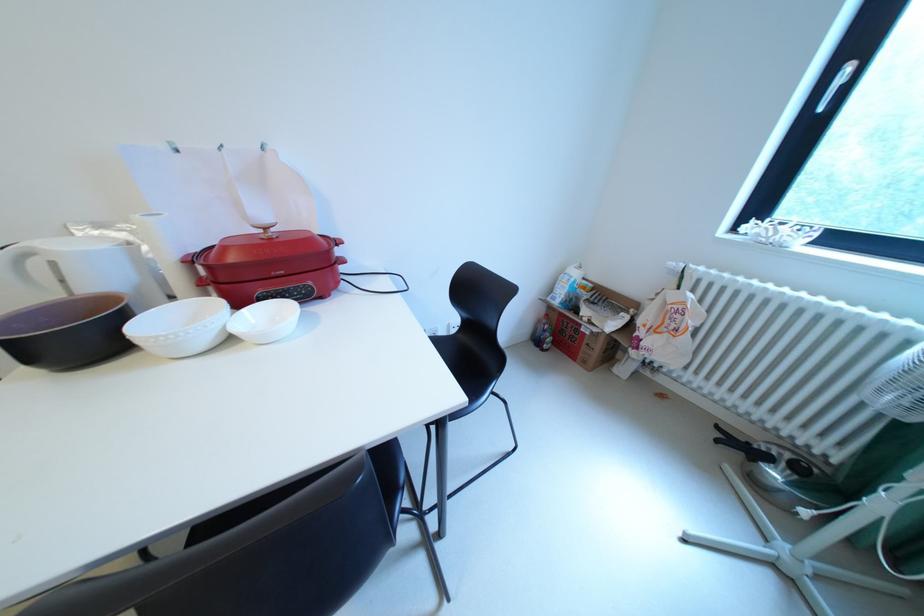
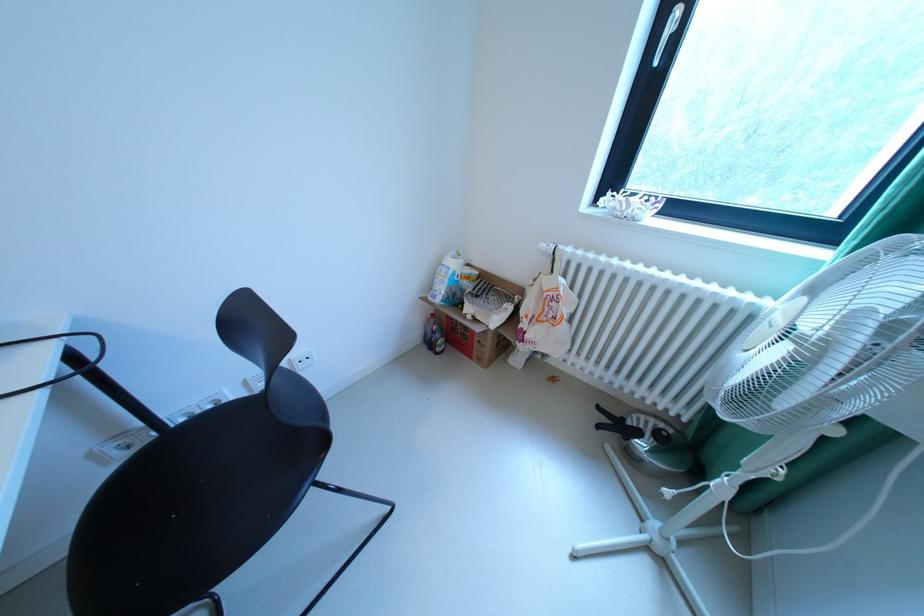
Find the pixel in the second image that matches point 573,285 in the first image.

(451, 278)